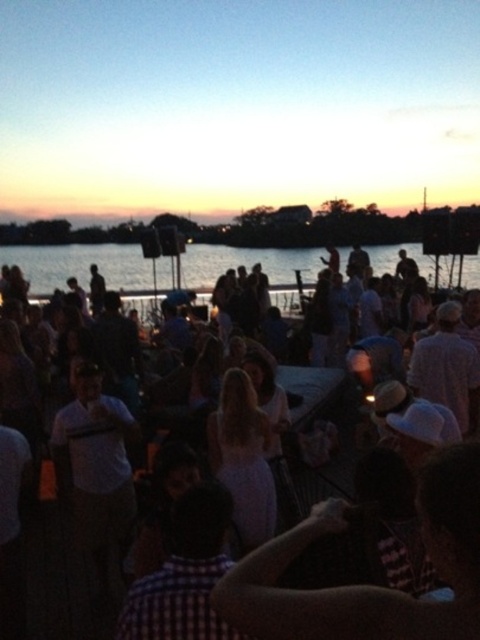
Question: Observing the image, what is the correct spatial positioning of white cotton dress at center in reference to blue water at center?

Choices:
 (A) left
 (B) right

Answer: (A)

Question: Which point appears closest to the camera in this image?

Choices:
 (A) (16, 260)
 (B) (462, 369)

Answer: (B)

Question: Which of the following is the farthest from the observer?

Choices:
 (A) (415, 250)
 (B) (324, 381)

Answer: (A)

Question: Is white cotton dress at center positioned at the back of blue water at center?

Choices:
 (A) yes
 (B) no

Answer: (B)

Question: Is white cotton dress at center wider than blue water at center?

Choices:
 (A) no
 (B) yes

Answer: (A)